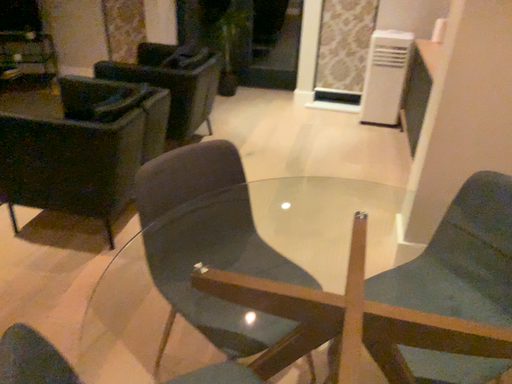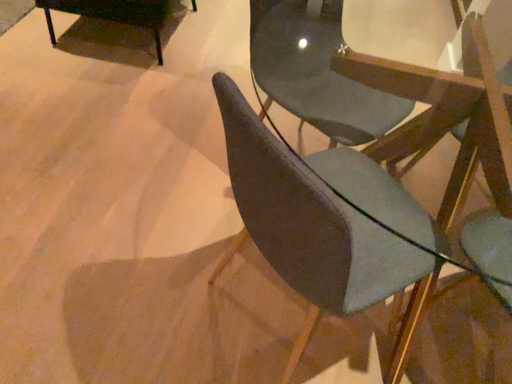
Question: How did the camera likely rotate when shooting the video?

Choices:
 (A) rotated upward
 (B) rotated downward

Answer: (B)